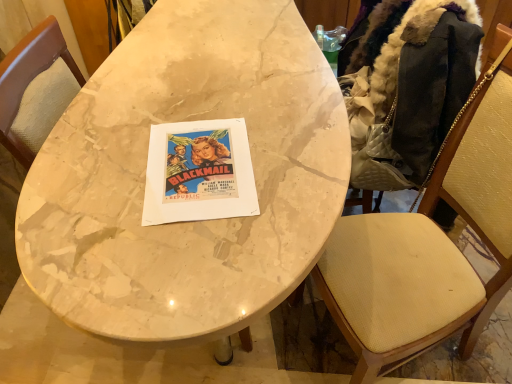
Question: Based on their positions, is marble table at center located to the left or right of dark brown fur-lined jacket at right?

Choices:
 (A) left
 (B) right

Answer: (A)

Question: Considering their positions, is marble table at center located in front of or behind dark brown fur-lined jacket at right?

Choices:
 (A) front
 (B) behind

Answer: (A)

Question: Which object is positioned closest to the marble table at center?

Choices:
 (A) dark brown fur-lined jacket at right
 (B) wooden textured chair at right

Answer: (A)

Question: Which object is positioned closest to the wooden textured chair at right?

Choices:
 (A) dark brown fur-lined jacket at right
 (B) marble table at center

Answer: (A)